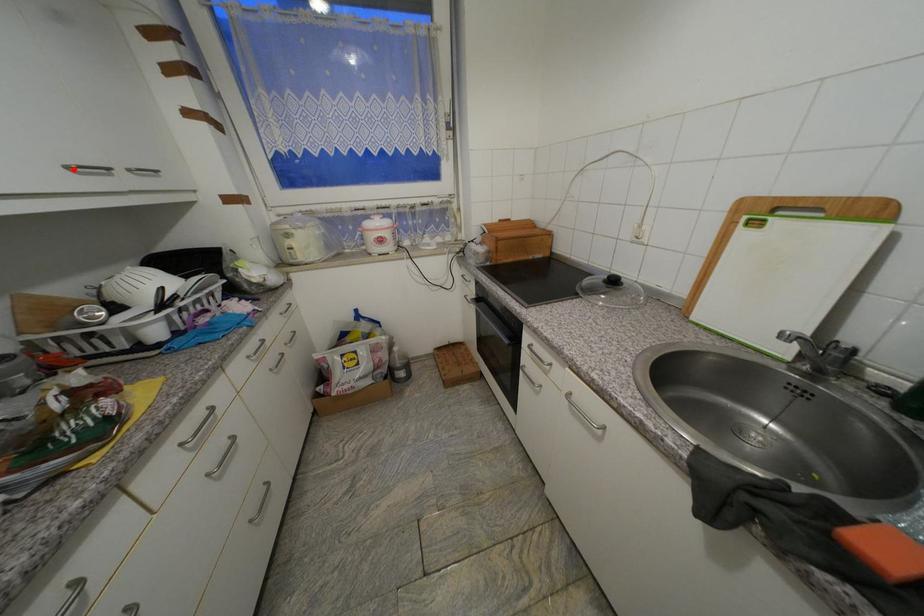
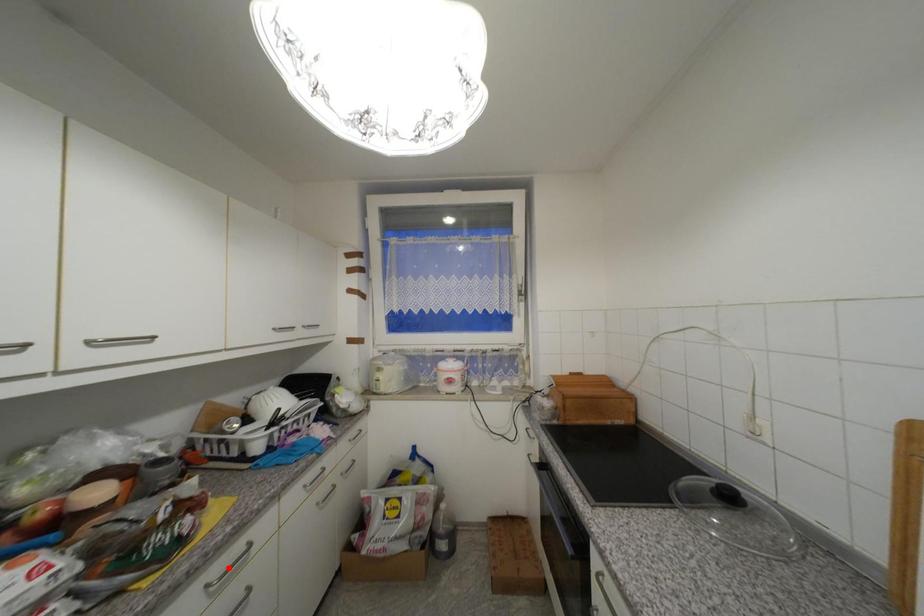
Based on the photo, I am providing you with two images of the same scene from different viewpoints. A red point is marked on the first image and another point is marked on the second image. Is the red point in image1 aligned with the point shown in image2?

No